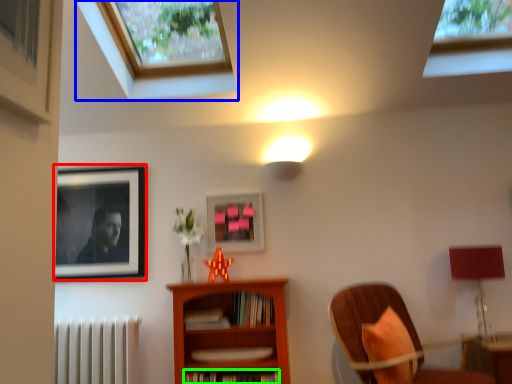
Question: Which is nearer to the picture frame (highlighted by a red box)? window (highlighted by a blue box) or book (highlighted by a green box).

Choices:
 (A) window
 (B) book

Answer: (A)